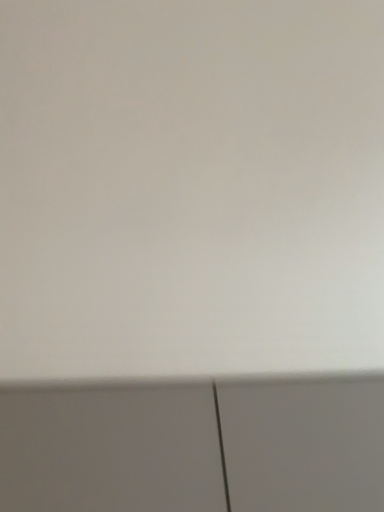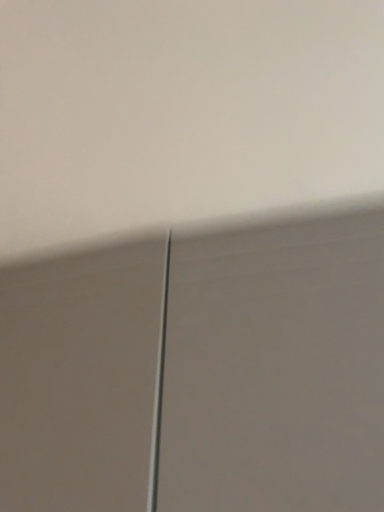
Question: Which way did the camera rotate in the video?

Choices:
 (A) rotated downward
 (B) rotated upward

Answer: (A)